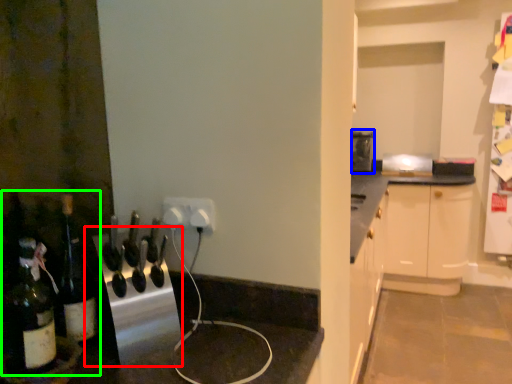
Question: Which object is the farthest from appliance (highlighted by a red box)? Choose among these: appliance (highlighted by a blue box) or wine tasting (highlighted by a green box).

Choices:
 (A) appliance
 (B) wine tasting

Answer: (A)